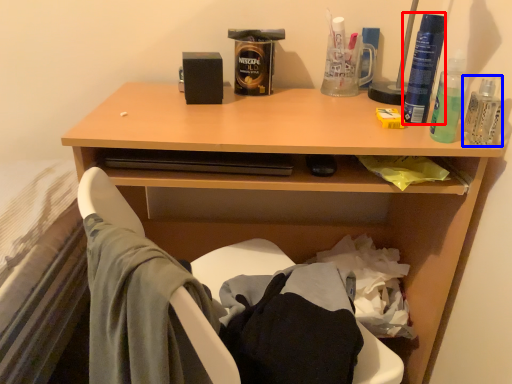
Question: Among these objects, which one is nearest to the camera, bottle (highlighted by a red box) or bottle (highlighted by a blue box)?

Choices:
 (A) bottle
 (B) bottle

Answer: (B)